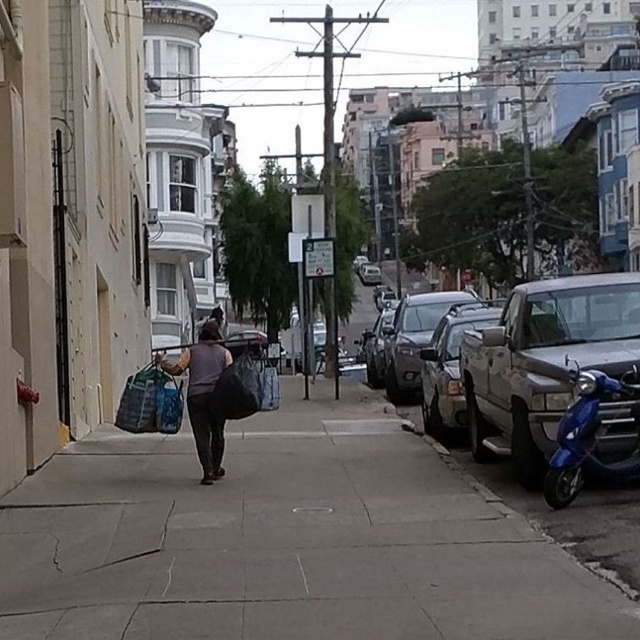
Question: Does silver metallic truck at center have a smaller size compared to textured fabric bag at center-left?

Choices:
 (A) yes
 (B) no

Answer: (B)

Question: Which object is the farthest from the gray concrete sidewalk at center?

Choices:
 (A) silver metallic truck at center
 (B) textured fabric bag at center-left

Answer: (A)

Question: Is blue glossy scooter at lower right wider than silver metallic truck at center?

Choices:
 (A) no
 (B) yes

Answer: (A)

Question: Can you confirm if gray concrete sidewalk at center is positioned above textured fabric bag at center-left?

Choices:
 (A) yes
 (B) no

Answer: (B)

Question: Which of these objects is positioned farthest from the dark brown fabric bag at center?

Choices:
 (A) blue glossy scooter at lower right
 (B) gray concrete sidewalk at center

Answer: (A)

Question: Which object is the farthest from the blue glossy scooter at lower right?

Choices:
 (A) silver metallic truck at center
 (B) textured fabric bag at center-left
 (C) dark brown fabric bag at center
 (D) gray concrete sidewalk at center

Answer: (B)